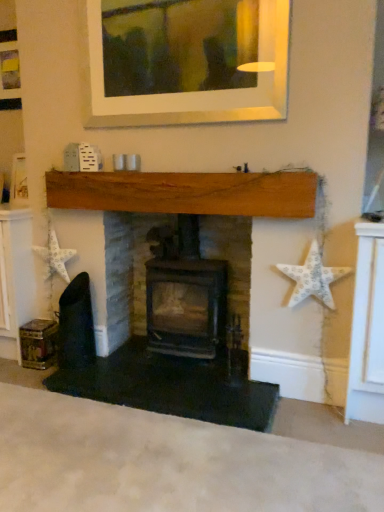
Question: From a real-world perspective, is white paper star at left, which appears as the first starfish when viewed from the left, above or below black cast iron stove at center, which appears as the first fireplace when viewed from the right?

Choices:
 (A) below
 (B) above

Answer: (B)

Question: Considering the positions of white paper star at left, the second starfish when ordered from right to left, and black cast iron stove at center, placed as the 2th fireplace when sorted from left to right, in the image, is white paper star at left, the second starfish when ordered from right to left, taller or shorter than black cast iron stove at center, placed as the 2th fireplace when sorted from left to right,?

Choices:
 (A) tall
 (B) short

Answer: (B)

Question: Which is nearer to the white paper star at left, which appears as the first starfish when viewed from the left?

Choices:
 (A) white textured star at right, which is the second starfish in left-to-right order
 (B) black cast iron stove at center, which appears as the first fireplace when viewed from the right
 (C) wooden fireplace at center, which is counted as the second fireplace, starting from the right

Answer: (C)

Question: Considering the real-world distances, which object is closest to the white paper star at left, the first starfish viewed from the back?

Choices:
 (A) white textured star at right, the first starfish from the right
 (B) wooden fireplace at center, which is counted as the second fireplace, starting from the right
 (C) black cast iron stove at center, placed as the 2th fireplace when sorted from left to right

Answer: (B)